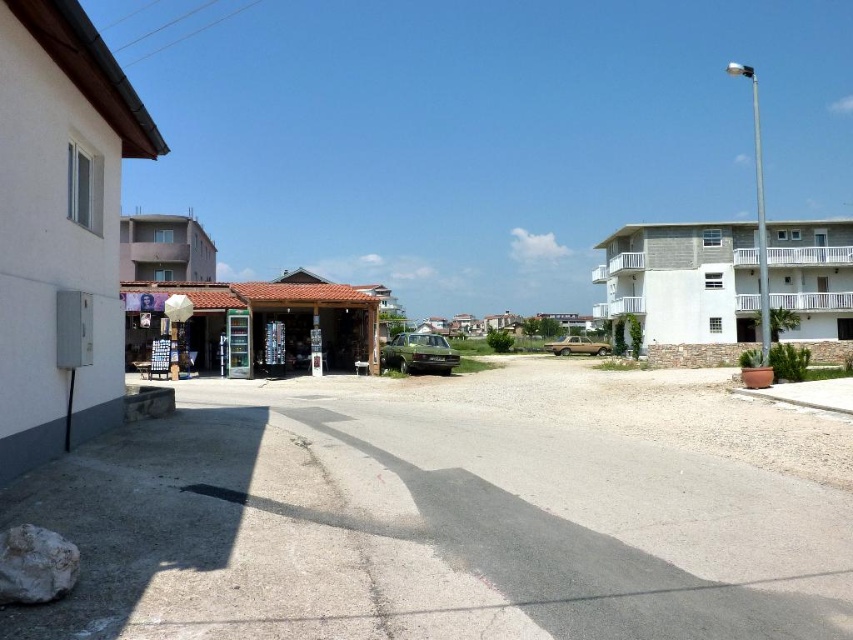
Question: Can you confirm if white concrete building at right is positioned to the left of matte brick shop at center?

Choices:
 (A) no
 (B) yes

Answer: (A)

Question: Considering the relative positions of white concrete building at right and gray concrete building at upper left in the image provided, where is white concrete building at right located with respect to gray concrete building at upper left?

Choices:
 (A) left
 (B) right

Answer: (B)

Question: Which point is closer to the camera?

Choices:
 (A) (207, 340)
 (B) (148, 280)

Answer: (A)

Question: Which object is positioned closest to the white concrete building at center?

Choices:
 (A) white concrete building at right
 (B) white matte building at left
 (C) gray concrete building at upper left
 (D) matte brick shop at center

Answer: (A)

Question: Which object is the farthest from the gray concrete building at upper left?

Choices:
 (A) matte brick shop at center
 (B) white concrete building at right

Answer: (B)

Question: Considering the relative positions of white matte building at left and matte brick shop at center in the image provided, where is white matte building at left located with respect to matte brick shop at center?

Choices:
 (A) below
 (B) above

Answer: (A)